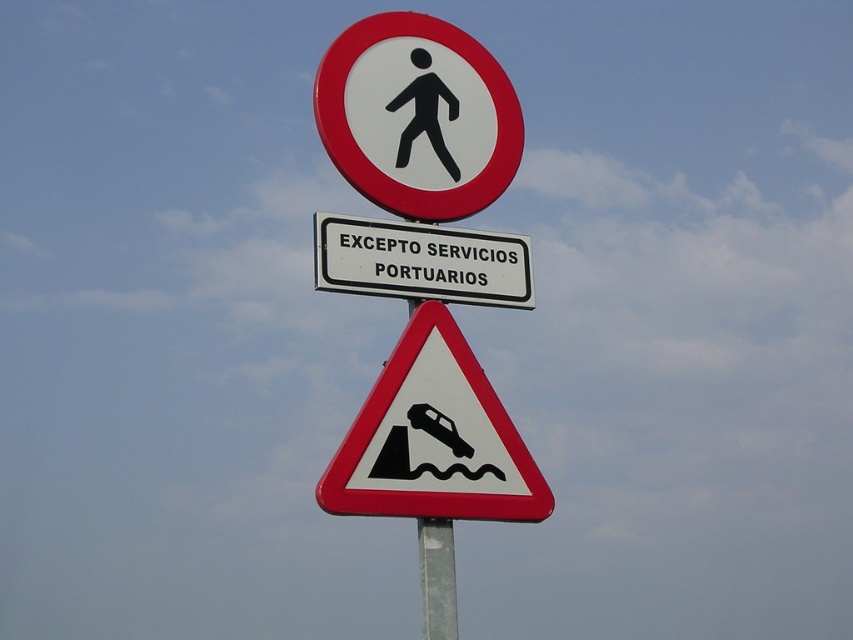
Between white plastic pedestrian at upper center and black plastic car at center, which one is positioned lower?

black plastic car at center is below.

Is white plastic pedestrian at upper center in front of black plastic car at center?

That is False.

Does point (407, 113) lie in front of point (492, 452)?

No.

You are a GUI agent. You are given a task and a screenshot of the screen. Output one action in this format:
    pyautogui.click(x=<x>, y=<y>)
    Task: Click on the white plastic pedestrian at upper center
    
    Given the screenshot: What is the action you would take?
    pyautogui.click(x=416, y=116)

Who is more distant from viewer, (358, 484) or (399, 234)?

The point (399, 234) is behind.

Is point (378, 440) closer to camera compared to point (403, 260)?

Yes, it is.

The width and height of the screenshot is (853, 640). In order to click on black plastic car at center in this screenshot , I will do `click(433, 438)`.

Who is lower down, white plastic pedestrian at upper center or white plastic text at center?

white plastic text at center is lower down.

The width and height of the screenshot is (853, 640). In order to click on white plastic pedestrian at upper center in this screenshot , I will do `click(416, 116)`.

Who is more distant from viewer, (x=325, y=84) or (x=404, y=228)?

Point (x=325, y=84)

Identify the location of white plastic pedestrian at upper center. The image size is (853, 640). (416, 116).